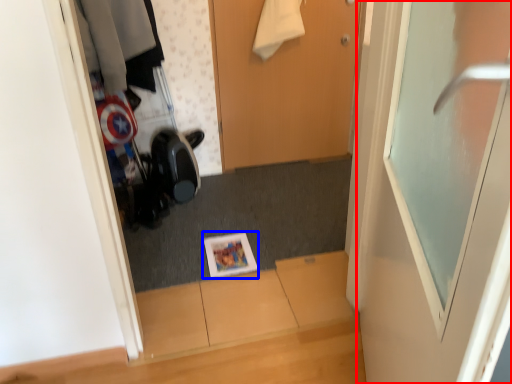
Question: Which object is further to the camera taking this photo, door (highlighted by a red box) or magazine (highlighted by a blue box)?

Choices:
 (A) door
 (B) magazine

Answer: (B)